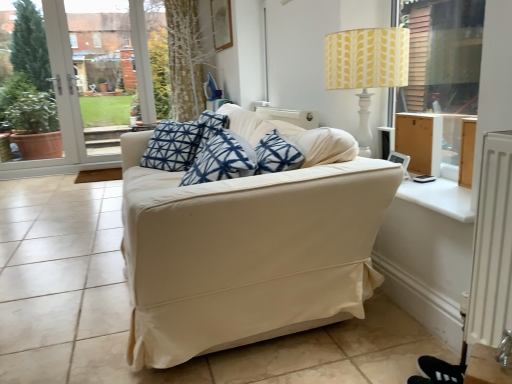
Question: Can you confirm if yellow fabric lampshade at upper right is bigger than white smooth window sill at right?

Choices:
 (A) yes
 (B) no

Answer: (A)

Question: Does yellow fabric lampshade at upper right turn towards white smooth window sill at right?

Choices:
 (A) yes
 (B) no

Answer: (B)

Question: Does yellow fabric lampshade at upper right have a lesser width compared to white smooth window sill at right?

Choices:
 (A) no
 (B) yes

Answer: (A)

Question: From a real-world perspective, is yellow fabric lampshade at upper right located beneath white smooth window sill at right?

Choices:
 (A) no
 (B) yes

Answer: (A)

Question: From the image's perspective, is yellow fabric lampshade at upper right above white smooth window sill at right?

Choices:
 (A) no
 (B) yes

Answer: (B)

Question: Is white glass door at left inside the boundaries of white smooth window sill at right, or outside?

Choices:
 (A) outside
 (B) inside

Answer: (A)

Question: From the image's perspective, is white glass door at left above or below white smooth window sill at right?

Choices:
 (A) below
 (B) above

Answer: (B)

Question: Considering the relative positions of white glass door at left and white smooth window sill at right in the image provided, is white glass door at left to the left or to the right of white smooth window sill at right?

Choices:
 (A) right
 (B) left

Answer: (B)

Question: Is point (38, 157) positioned closer to the camera than point (434, 183)?

Choices:
 (A) closer
 (B) farther

Answer: (B)

Question: In the image, is beige fabric couch at center positioned in front of or behind white glass door at left?

Choices:
 (A) behind
 (B) front

Answer: (B)

Question: Which is correct: beige fabric couch at center is inside white glass door at left, or outside of it?

Choices:
 (A) outside
 (B) inside

Answer: (A)

Question: From the image's perspective, relative to white glass door at left, is beige fabric couch at center above or below?

Choices:
 (A) below
 (B) above

Answer: (A)

Question: Is point (201, 321) closer or farther from the camera than point (5, 13)?

Choices:
 (A) farther
 (B) closer

Answer: (B)

Question: From the image's perspective, is beige fabric couch at center located above or below white smooth window sill at right?

Choices:
 (A) above
 (B) below

Answer: (A)

Question: Is beige fabric couch at center in front of or behind white smooth window sill at right in the image?

Choices:
 (A) behind
 (B) front

Answer: (B)